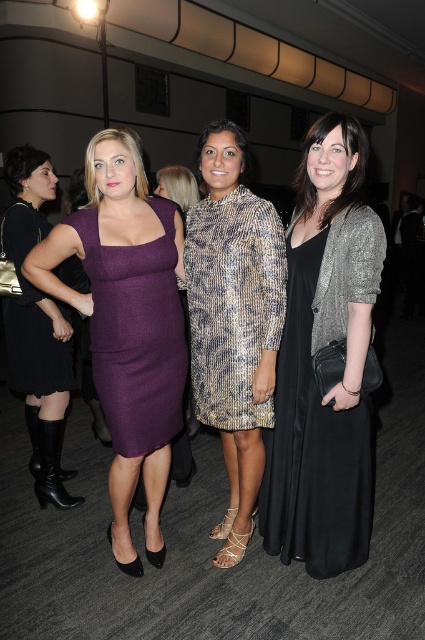
Looking at the two dresses in the image, the black satin dress at center and the black matte dress at left, which one is positioned to the right of the other?

The black satin dress at center is positioned to the right of the black matte dress at left.

You are taking a photo of two points in the scene. The first point is at coordinate point(325, 269) and the second is at point(11, 246). Which point will appear larger in your photo?

Point(325, 269) is closer to the camera than point(11, 246), so it will appear larger in the photo.